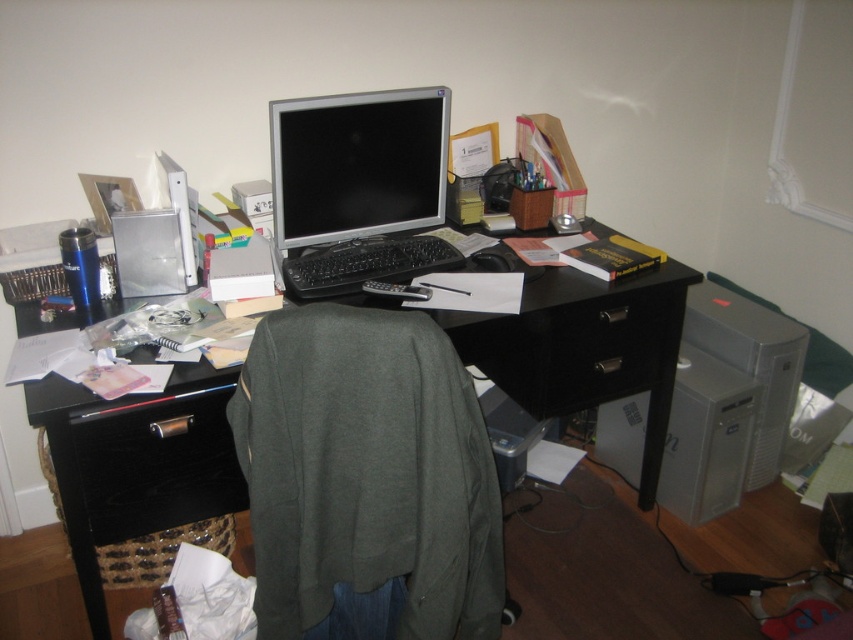
Question: Is black matte computer desk at center in front of black plastic drawer at center?

Choices:
 (A) yes
 (B) no

Answer: (A)

Question: Does black matte computer desk at center appear on the right side of black plastic drawer at center?

Choices:
 (A) no
 (B) yes

Answer: (A)

Question: Which object is closer to the camera taking this photo?

Choices:
 (A) black wood drawer at lower left
 (B) black plastic drawer at center
 (C) black matte computer desk at center
 (D) silver metallic monitor at center

Answer: (C)

Question: Can you confirm if black wood drawer at lower left is smaller than black plastic drawer at center?

Choices:
 (A) yes
 (B) no

Answer: (A)

Question: Which object is closer to the camera taking this photo?

Choices:
 (A) black matte computer desk at center
 (B) black plastic drawer at center
 (C) silver metallic monitor at center
 (D) black wood drawer at lower left

Answer: (A)

Question: Which object is positioned closest to the black wood drawer at lower left?

Choices:
 (A) black matte computer desk at center
 (B) silver metallic monitor at center
 (C) black plastic drawer at center

Answer: (A)